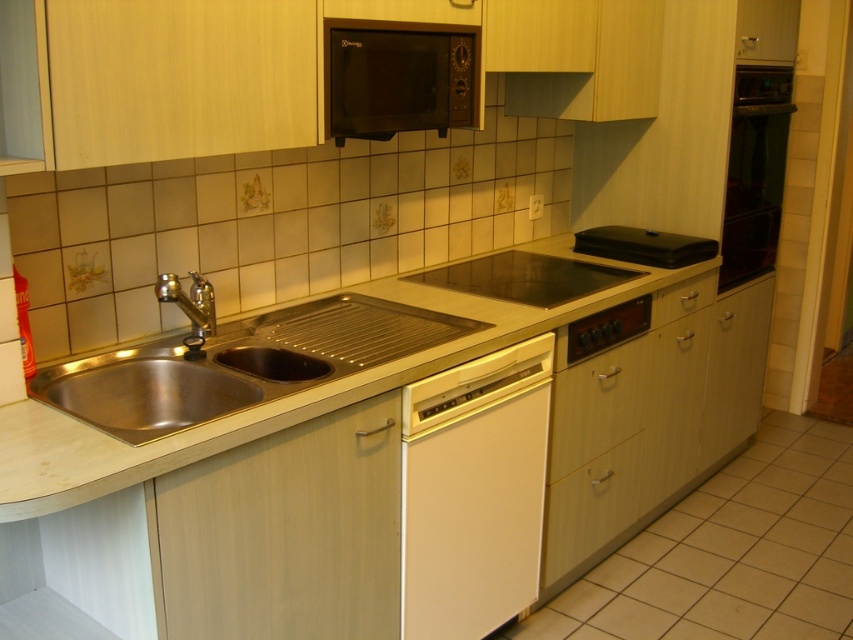
Who is positioned more to the right, stainless steel sink at left or black glass cooktop at center?

From the viewer's perspective, black glass cooktop at center appears more on the right side.

Is point (253, 346) farther from viewer compared to point (479, 264)?

No, it is not.

Between point (258, 394) and point (526, 272), which one is positioned behind?

Point (526, 272)

You are a GUI agent. You are given a task and a screenshot of the screen. Output one action in this format:
    pyautogui.click(x=<x>, y=<y>)
    Task: Click on the stainless steel sink at left
    This screenshot has width=853, height=640.
    Given the screenshot: What is the action you would take?
    (x=180, y=372)

This screenshot has width=853, height=640. I want to click on black matte microwave at upper center, so click(x=398, y=77).

Who is more distant from viewer, (474, 100) or (596, 436)?

The point (596, 436) is more distant.

Between point (350, 122) and point (595, 419), which one is positioned behind?

The point (595, 419) is behind.

Find the location of `black matte microwave at upper center`. black matte microwave at upper center is located at coordinates (398, 77).

Which is in front, point (505, 358) or point (165, 289)?

Point (165, 289) is in front.

Does white matte dishwasher at center have a larger size compared to silver metallic faucet at left?

Yes, white matte dishwasher at center is bigger than silver metallic faucet at left.

Between point (527, 508) and point (195, 326), which one is positioned behind?

The point (527, 508) is behind.

Locate an element on the screen. The width and height of the screenshot is (853, 640). white matte dishwasher at center is located at coordinates (473, 492).